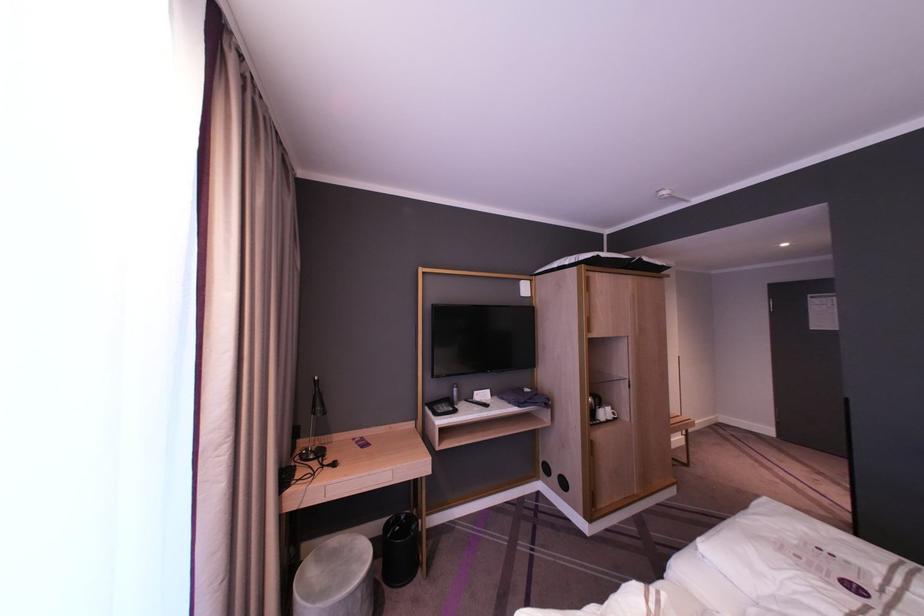
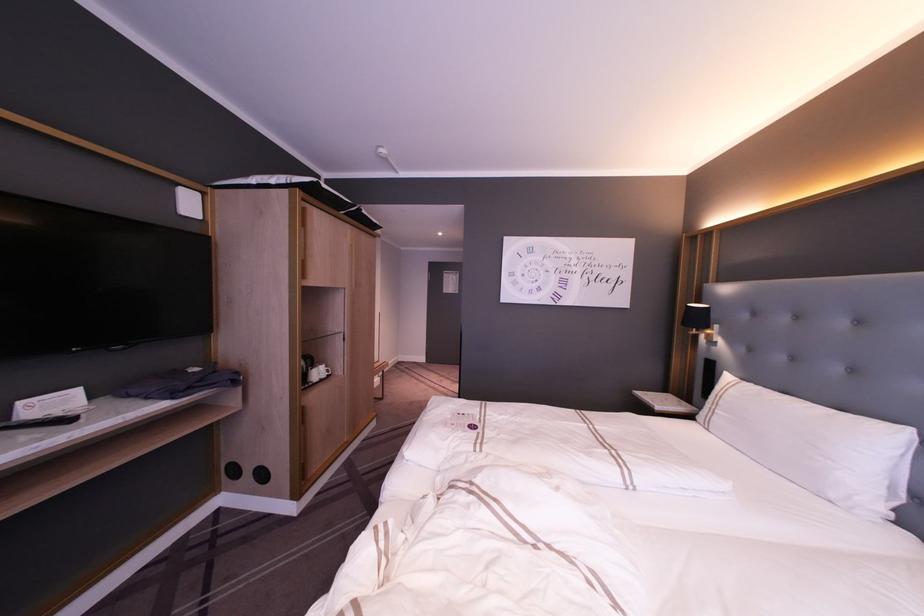
The point at [606,421] is marked in the first image. Where is the corresponding point in the second image?

(321, 379)